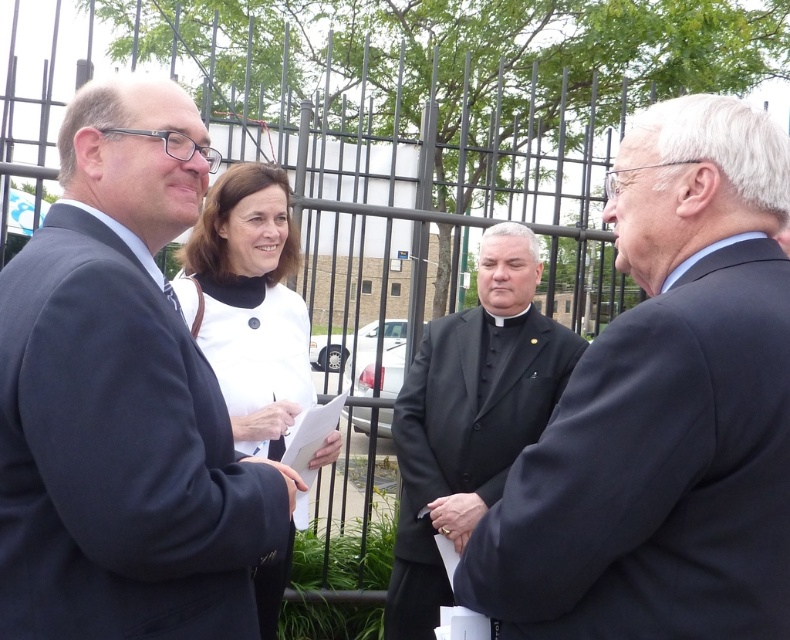
Question: Which point is closer to the camera?

Choices:
 (A) (478, 534)
 (B) (140, 388)
 (C) (246, 228)
 (D) (401, 493)

Answer: (B)

Question: Which of the following is the farthest from the observer?

Choices:
 (A) (629, 196)
 (B) (435, 392)

Answer: (B)

Question: Can you confirm if black matte suit at right is thinner than white matte jacket at center?

Choices:
 (A) no
 (B) yes

Answer: (A)

Question: From the image, what is the correct spatial relationship of matte black suit at left in relation to white matte jacket at center?

Choices:
 (A) right
 (B) left

Answer: (A)

Question: Does black matte suit at right have a greater width compared to black matte suit at center?

Choices:
 (A) yes
 (B) no

Answer: (B)

Question: Which point is farther to the camera?

Choices:
 (A) matte black suit at left
 (B) white matte jacket at center
 (C) black matte suit at center
 (D) black matte suit at right

Answer: (C)